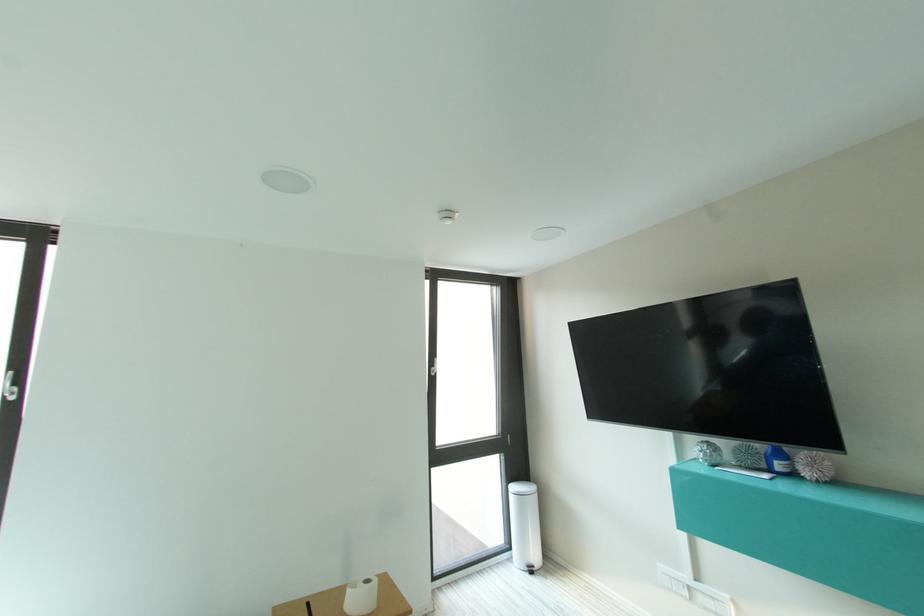
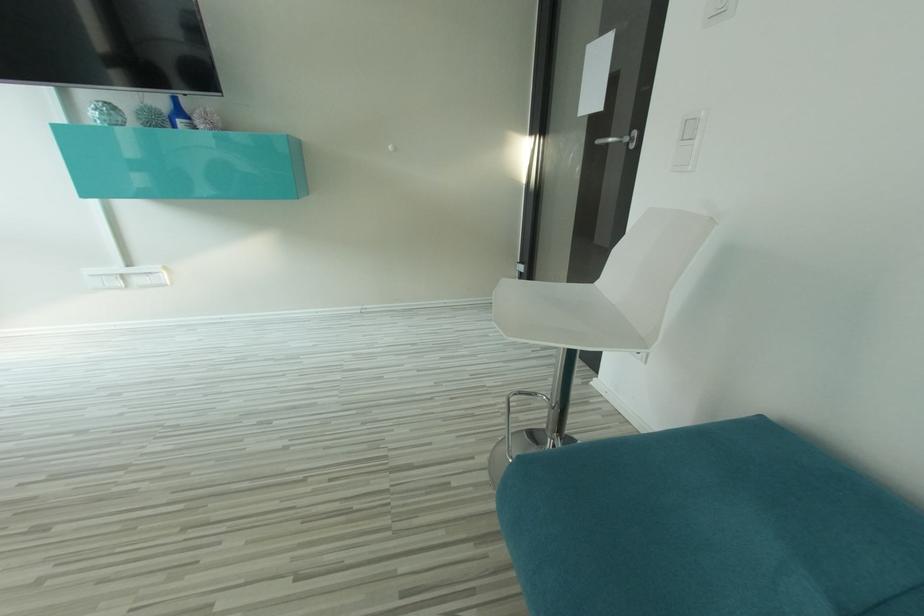
From the picture: The first image is from the beginning of the video and the second image is from the end. How did the camera likely rotate when shooting the video?

The camera's rotation is toward right-down.